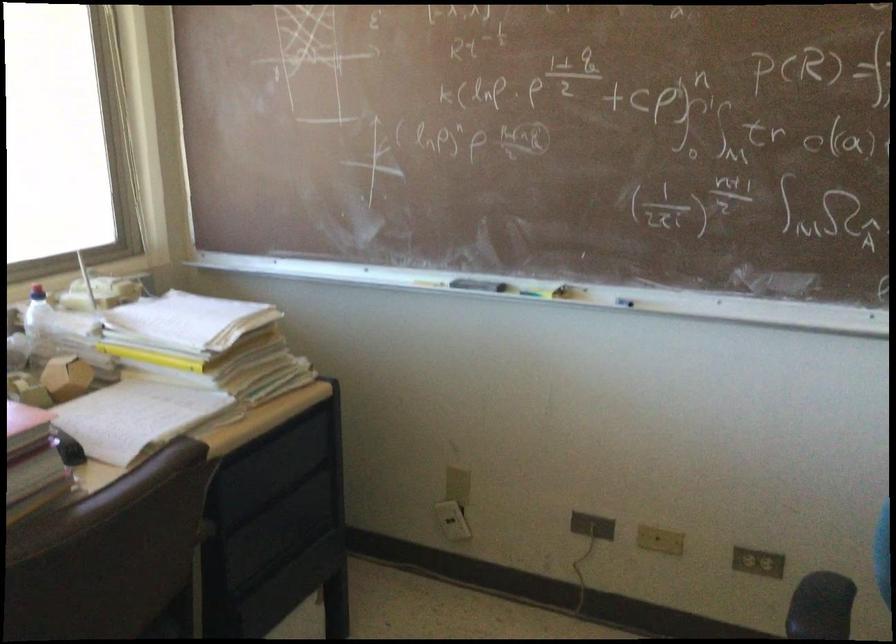
What are the coordinates of `blue bottle cap` in the screenshot? It's located at (37, 292).